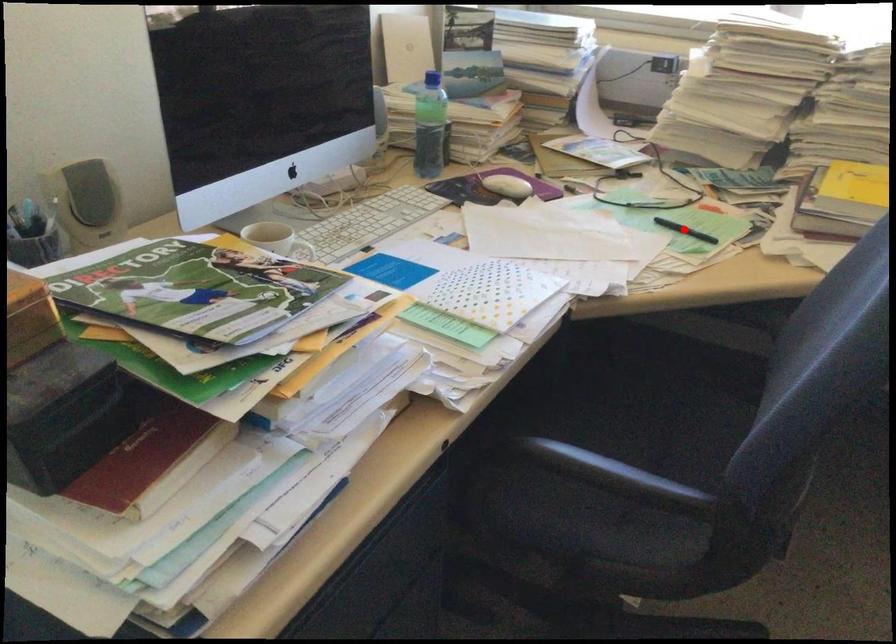
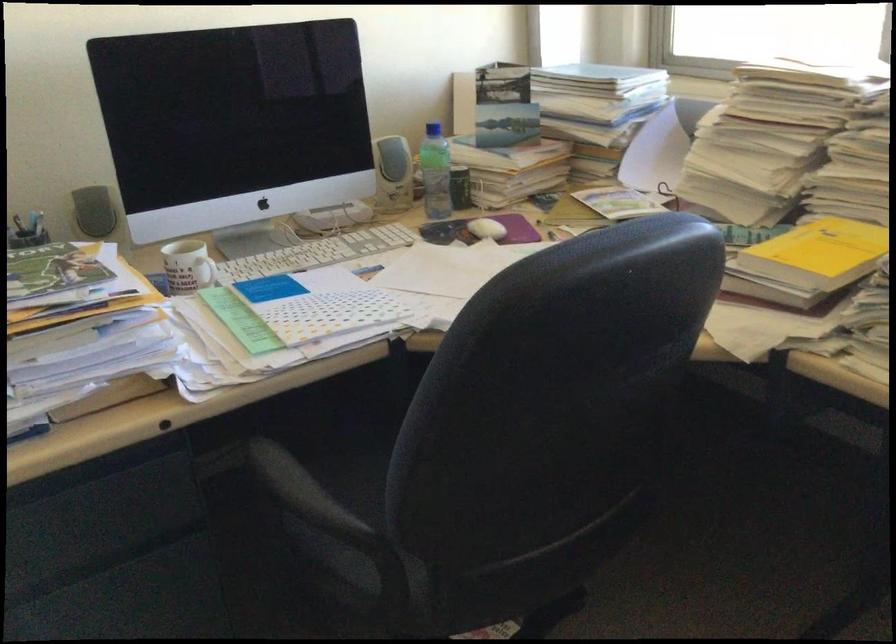
Question: I am providing you with two images of the same scene from different viewpoints. A red point is marked on the first image. Is the red point's position out of view in image 2?

Choices:
 (A) Yes
 (B) No

Answer: (A)